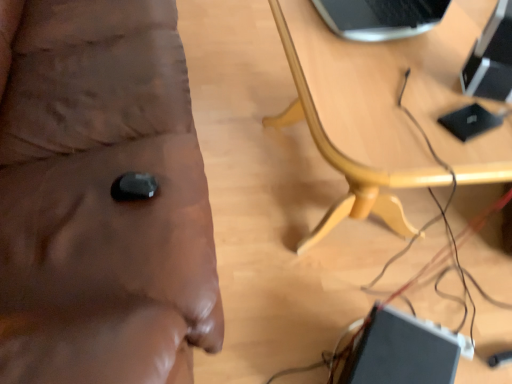
Question: Is wooden table at center at the left side of wooden table at center?

Choices:
 (A) yes
 (B) no

Answer: (A)

Question: Is wooden table at center bigger than wooden table at center?

Choices:
 (A) no
 (B) yes

Answer: (B)

Question: Does wooden table at center come behind wooden table at center?

Choices:
 (A) yes
 (B) no

Answer: (B)

Question: Is wooden table at center surrounded by wooden table at center?

Choices:
 (A) yes
 (B) no

Answer: (B)

Question: Does wooden table at center lie in front of wooden table at center?

Choices:
 (A) yes
 (B) no

Answer: (A)

Question: From their relative heights in the image, would you say black glossy computer at upper right is taller or shorter than black glossy laptop at lower right?

Choices:
 (A) short
 (B) tall

Answer: (A)

Question: Is black glossy computer at upper right inside the boundaries of black glossy laptop at lower right, or outside?

Choices:
 (A) outside
 (B) inside

Answer: (A)

Question: Considering their positions, is black glossy computer at upper right located in front of or behind black glossy laptop at lower right?

Choices:
 (A) behind
 (B) front

Answer: (B)

Question: Is black glossy computer at upper right bigger or smaller than black glossy laptop at lower right?

Choices:
 (A) small
 (B) big

Answer: (A)

Question: Looking at the image, does wooden table at center seem bigger or smaller compared to wooden table at center?

Choices:
 (A) small
 (B) big

Answer: (A)

Question: Considering the positions of wooden table at center and wooden table at center in the image, is wooden table at center wider or thinner than wooden table at center?

Choices:
 (A) thin
 (B) wide

Answer: (A)

Question: From the image's perspective, is wooden table at center above or below wooden table at center?

Choices:
 (A) above
 (B) below

Answer: (B)

Question: From a real-world perspective, is wooden table at center positioned above or below wooden table at center?

Choices:
 (A) above
 (B) below

Answer: (B)

Question: Choose the correct answer: Is wooden table at center inside black glossy computer at upper right or outside it?

Choices:
 (A) outside
 (B) inside

Answer: (A)

Question: Considering the relative positions of wooden table at center and black glossy computer at upper right in the image provided, is wooden table at center to the left or to the right of black glossy computer at upper right?

Choices:
 (A) right
 (B) left

Answer: (B)